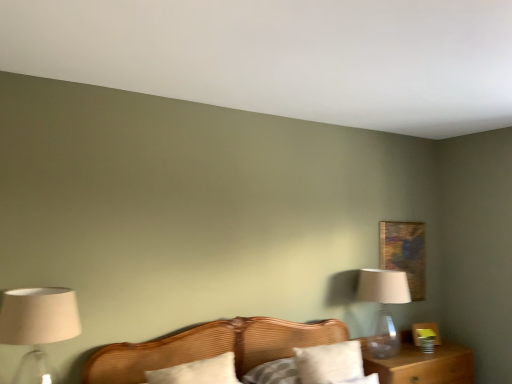
Question: Considering the relative sizes of white soft pillow at center, the 2th pillow in the right-to-left sequence, and white cotton pillow at center, the 2th pillow in the left-to-right sequence, in the image provided, is white soft pillow at center, the 2th pillow in the right-to-left sequence, taller than white cotton pillow at center, the 2th pillow in the left-to-right sequence,?

Choices:
 (A) yes
 (B) no

Answer: (B)

Question: From the image's perspective, is white soft pillow at center, marked as the first pillow in a left-to-right arrangement, located above white cotton pillow at center, which appears as the 1th pillow when viewed from the right?

Choices:
 (A) no
 (B) yes

Answer: (A)

Question: Can you confirm if white soft pillow at center, marked as the first pillow in a left-to-right arrangement, is positioned to the left of white cotton pillow at center, the 2th pillow in the left-to-right sequence?

Choices:
 (A) yes
 (B) no

Answer: (A)

Question: Can you confirm if white soft pillow at center, marked as the first pillow in a left-to-right arrangement, is positioned to the right of white cotton pillow at center, the 2th pillow in the left-to-right sequence?

Choices:
 (A) no
 (B) yes

Answer: (A)

Question: Considering the relative positions of white soft pillow at center, the 2th pillow in the right-to-left sequence, and white cotton pillow at center, the 2th pillow in the left-to-right sequence, in the image provided, is white soft pillow at center, the 2th pillow in the right-to-left sequence, behind white cotton pillow at center, the 2th pillow in the left-to-right sequence,?

Choices:
 (A) no
 (B) yes

Answer: (A)

Question: Is white soft pillow at center, the 2th pillow in the right-to-left sequence, positioned far away from white cotton pillow at center, the 2th pillow in the left-to-right sequence?

Choices:
 (A) yes
 (B) no

Answer: (B)

Question: Can you confirm if white soft pillow at center, marked as the first pillow in a left-to-right arrangement, is taller than wooden bed at center?

Choices:
 (A) no
 (B) yes

Answer: (A)

Question: Is white soft pillow at center, the 2th pillow in the right-to-left sequence, not close to wooden bed at center?

Choices:
 (A) no
 (B) yes

Answer: (A)

Question: From a real-world perspective, does white soft pillow at center, the 2th pillow in the right-to-left sequence, stand above wooden bed at center?

Choices:
 (A) no
 (B) yes

Answer: (A)

Question: From a real-world perspective, is white soft pillow at center, the 2th pillow in the right-to-left sequence, located beneath wooden bed at center?

Choices:
 (A) no
 (B) yes

Answer: (B)

Question: Does white soft pillow at center, marked as the first pillow in a left-to-right arrangement, have a lesser width compared to wooden bed at center?

Choices:
 (A) yes
 (B) no

Answer: (A)

Question: Is white soft pillow at center, the 2th pillow in the right-to-left sequence, smaller than wooden bed at center?

Choices:
 (A) no
 (B) yes

Answer: (B)

Question: Is wooden bed at center not inside transparent glass table lamp at right?

Choices:
 (A) yes
 (B) no

Answer: (A)